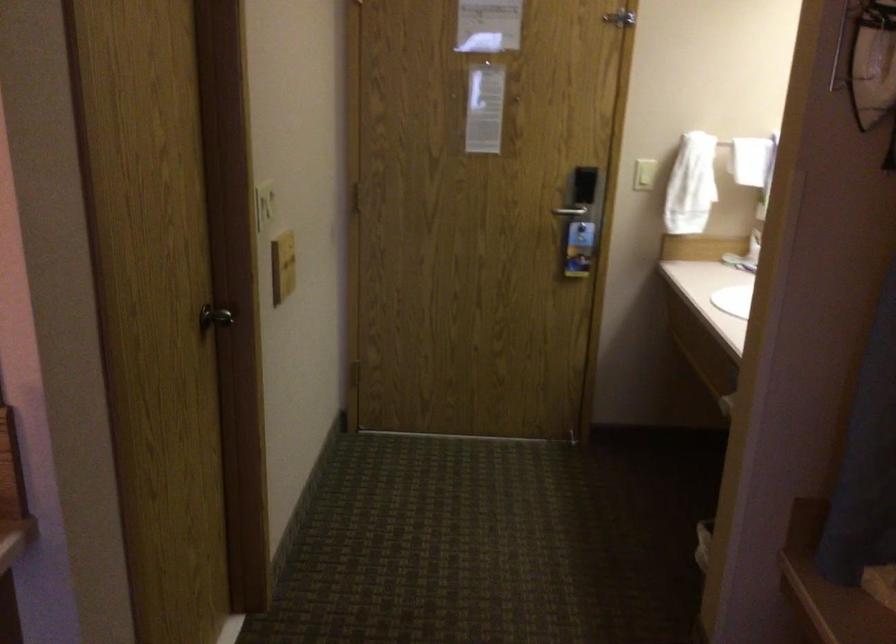
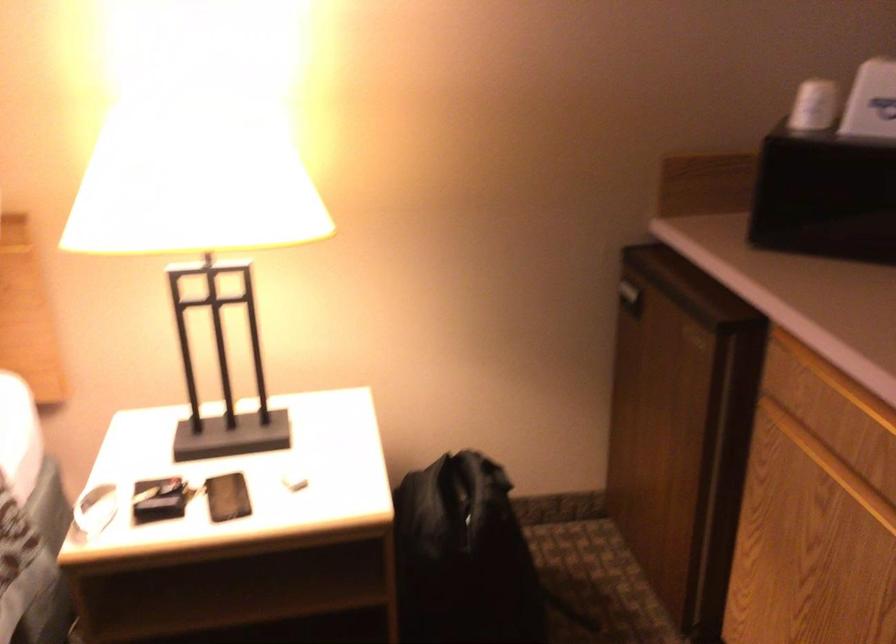
Question: The camera is either moving clockwise (left) or counter-clockwise (right) around the object. The first image is from the beginning of the video and the second image is from the end. Is the camera moving left or right when shooting the video?

Choices:
 (A) Left
 (B) Right

Answer: (B)